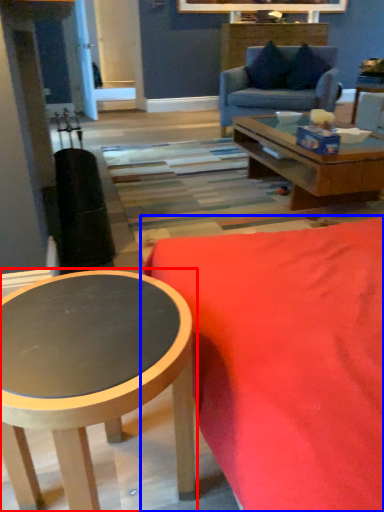
Question: Among these objects, which one is nearest to the camera, coffee table (highlighted by a red box) or studio couch (highlighted by a blue box)?

Choices:
 (A) coffee table
 (B) studio couch

Answer: (B)